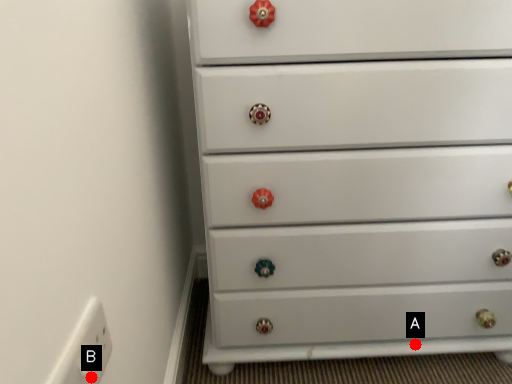
Question: Two points are circled on the image, labeled by A and B beside each circle. Which point is closer to the camera taking this photo?

Choices:
 (A) A is closer
 (B) B is closer

Answer: (B)